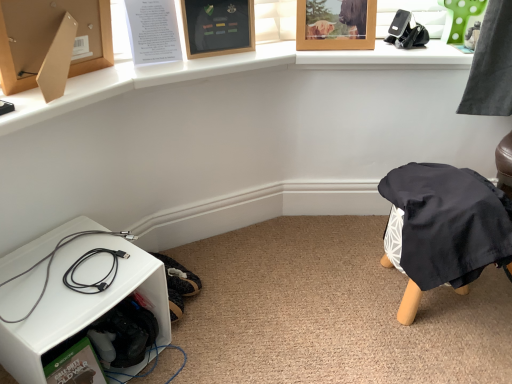
This screenshot has width=512, height=384. In order to click on free space in front of wooden picture frame at upper center, the 2th picture frame when ordered from right to left in this screenshot , I will do (210, 62).